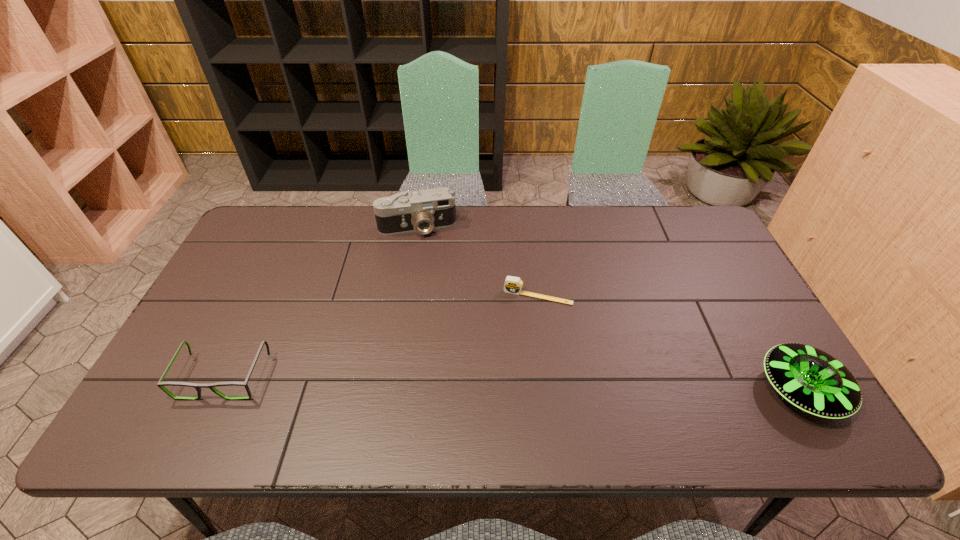
Locate an element on the screen. This screenshot has height=540, width=960. free space on the desktop that is between the second shortest object and the saucer and is positioned on the lens of the camera is located at coordinates (447, 382).

Where is `vacant space on the desktop that is between the spectacles and the rightmost object and is positioned at the front of the third object from left to right with the tape extended`? Image resolution: width=960 pixels, height=540 pixels. vacant space on the desktop that is between the spectacles and the rightmost object and is positioned at the front of the third object from left to right with the tape extended is located at coordinates (516, 383).